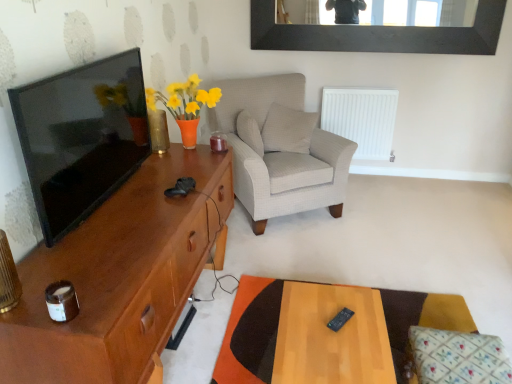
Locate an element on the screen. vacant space behind black plastic remote at center is located at coordinates (333, 299).